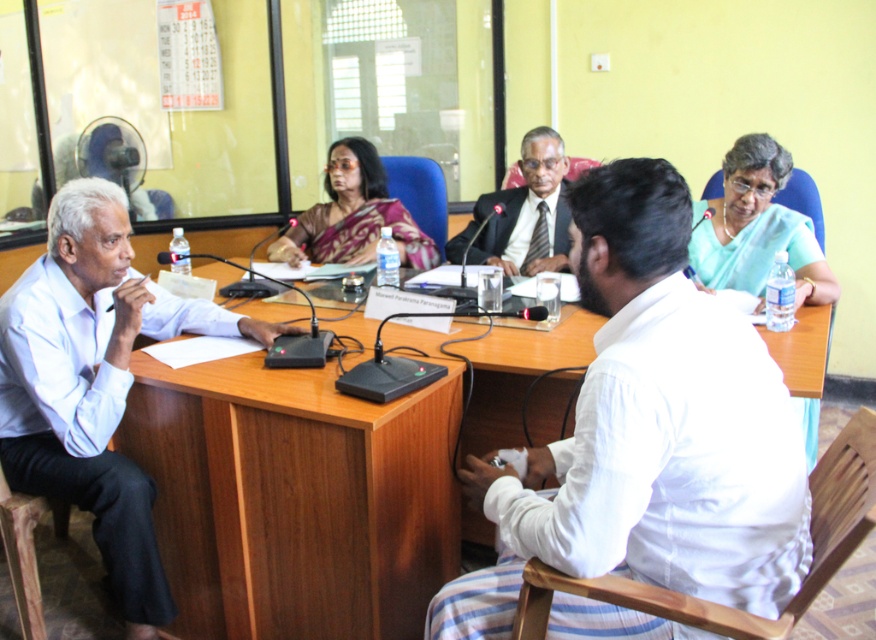
Does wooden table at center appear on the left side of satin sari at center?

Incorrect, wooden table at center is not on the left side of satin sari at center.

Does point (786, 365) come behind point (365, 172)?

No, (786, 365) is closer to viewer.

You are a GUI agent. You are given a task and a screenshot of the screen. Output one action in this format:
    pyautogui.click(x=<x>, y=<y>)
    Task: Click on the wooden table at center
    Image resolution: width=876 pixels, height=640 pixels.
    Given the screenshot: What is the action you would take?
    pyautogui.click(x=299, y=496)

How far apart are satin sari at center and matte black suit at center?

They are 39.87 centimeters apart.

Between satin sari at center and matte black suit at center, which one is positioned higher?

matte black suit at center

Which is behind, point (309, 250) or point (557, 144)?

Point (309, 250)

Where is `satin sari at center`? satin sari at center is located at coordinates click(x=352, y=216).

Does white cotton shirt at center have a greater height compared to light blue fabric saree at upper right?

Yes.

Locate an element on the screen. white cotton shirt at center is located at coordinates (648, 433).

Find the location of a particular element. white cotton shirt at center is located at coordinates (648, 433).